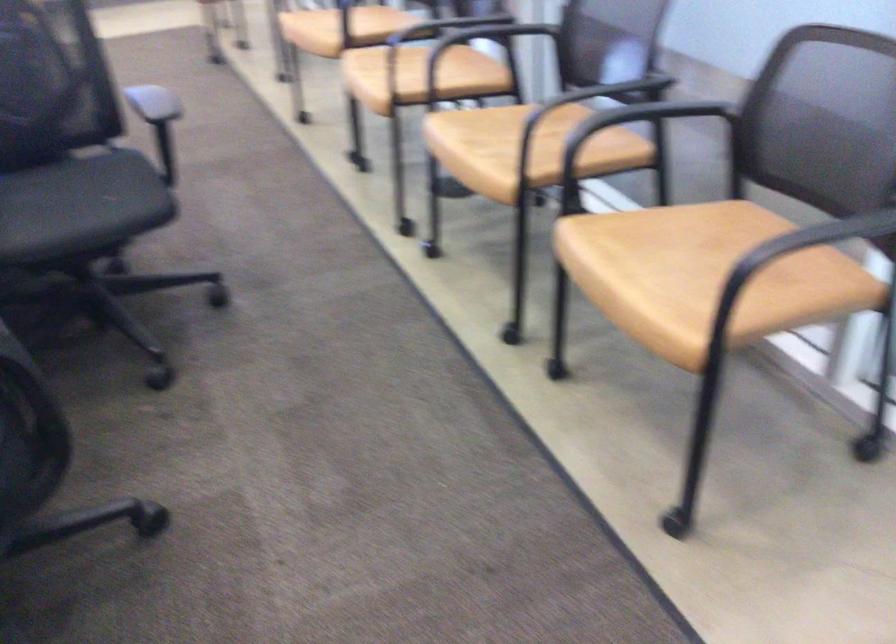
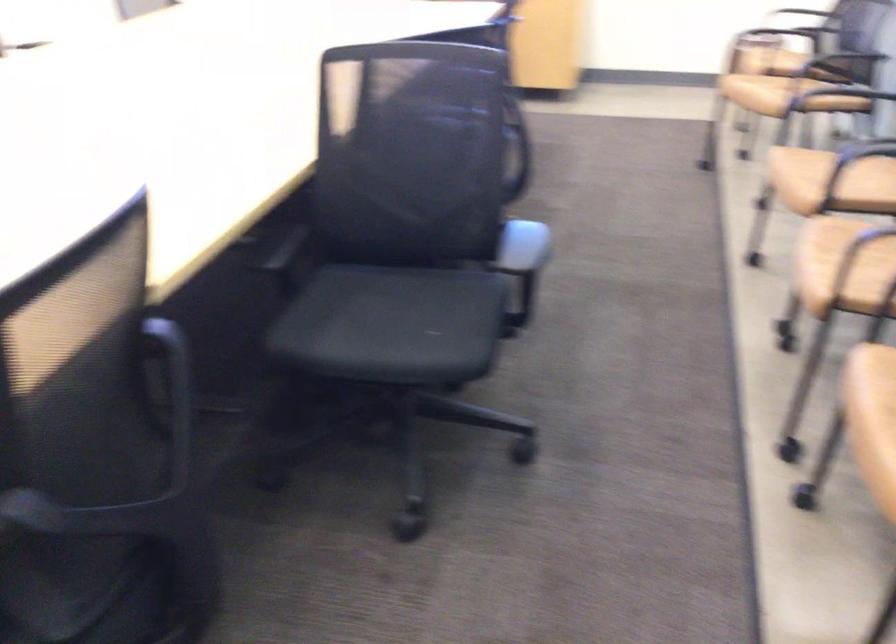
Question: The camera is either moving clockwise (left) or counter-clockwise (right) around the object. The first image is from the beginning of the video and the second image is from the end. Is the camera moving left or right when shooting the video?

Choices:
 (A) Left
 (B) Right

Answer: (B)